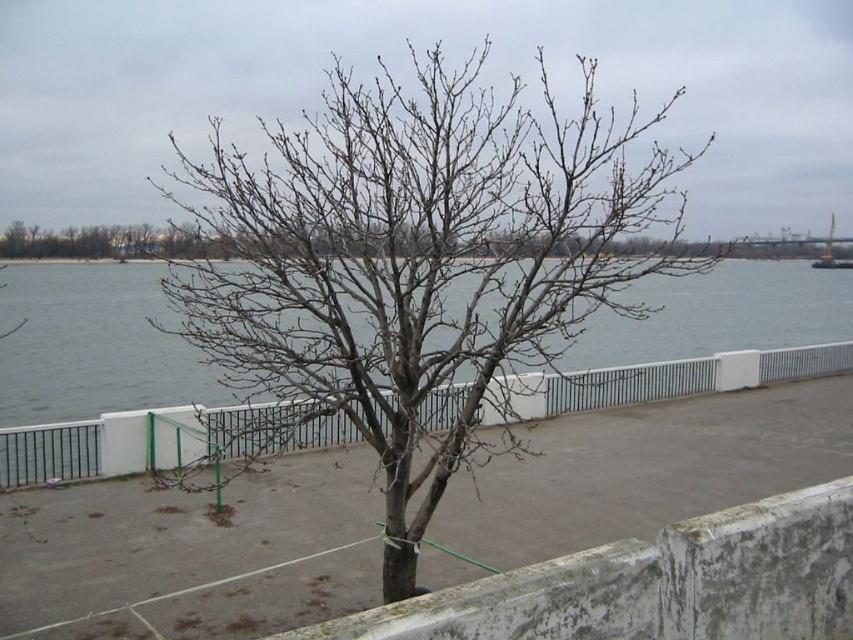
You are a gardener checking the growth of plants near the white concrete fence at center. You notice the bare branches at center. Are the branches above or below the fence?

The bare branches at center is positioned over the white concrete fence at center, so the branches are above the fence.

You are a gardener assessing the space between the bare branches at center and the white concrete fence at center. Which object takes up more space in the scene?

The bare branches at center has a larger size compared to the white concrete fence at center, so the bare branches at center takes up more space in the scene.

You are standing at the origin point of the image. Where exactly is the bare branches at center located?

The bare branches at center are located at point (416, 259).